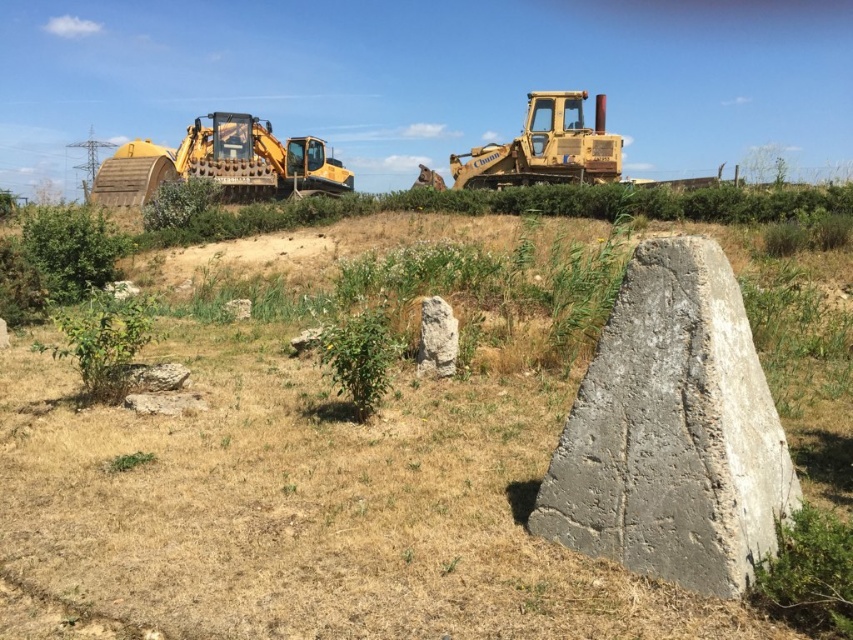
Question: Is dry grass at center below gray rough stone at center?

Choices:
 (A) yes
 (B) no

Answer: (B)

Question: Is dry grass at center wider than gray concrete boulder at center?

Choices:
 (A) yes
 (B) no

Answer: (A)

Question: Which point is farther to the camera?

Choices:
 (A) (505, 166)
 (B) (688, 244)

Answer: (A)

Question: Which point appears closest to the camera in this image?

Choices:
 (A) (573, 116)
 (B) (612, 440)

Answer: (B)

Question: Is dry grass at center to the right of yellow metallic tractor at upper center from the viewer's perspective?

Choices:
 (A) no
 (B) yes

Answer: (A)

Question: Which point is closer to the camera?

Choices:
 (A) (47, 513)
 (B) (604, 168)
 (C) (433, 356)
 (D) (125, 145)

Answer: (A)